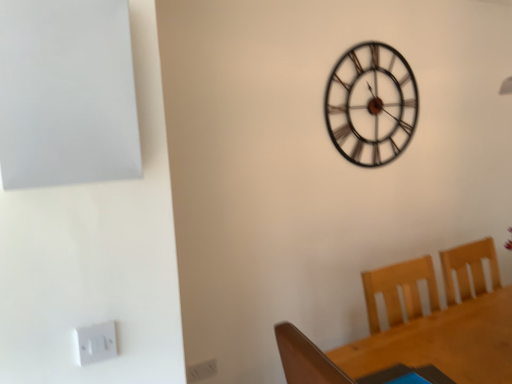
Question: Would you say wooden table at lower right is inside or outside white plastic electric outlet at lower left?

Choices:
 (A) outside
 (B) inside

Answer: (A)

Question: From the image's perspective, is wooden table at lower right located above or below white plastic electric outlet at lower left?

Choices:
 (A) above
 (B) below

Answer: (B)

Question: Which is nearer to the white plastic electric outlet at lower left?

Choices:
 (A) wooden table at lower right
 (B) metallic black clock at upper center

Answer: (A)

Question: Estimate the real-world distances between objects in this image. Which object is farther from the wooden table at lower right?

Choices:
 (A) metallic black clock at upper center
 (B) white plastic electric outlet at lower left

Answer: (B)